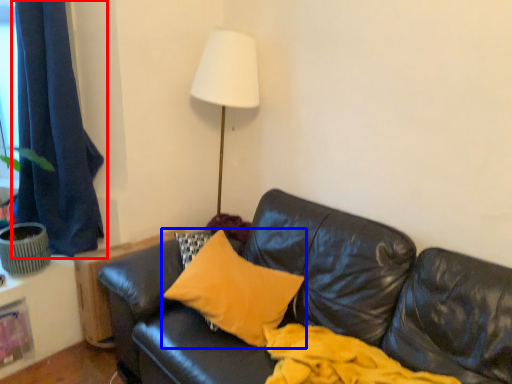
Question: Which object is closer to the camera taking this photo, curtain (highlighted by a red box) or pillow (highlighted by a blue box)?

Choices:
 (A) curtain
 (B) pillow

Answer: (B)